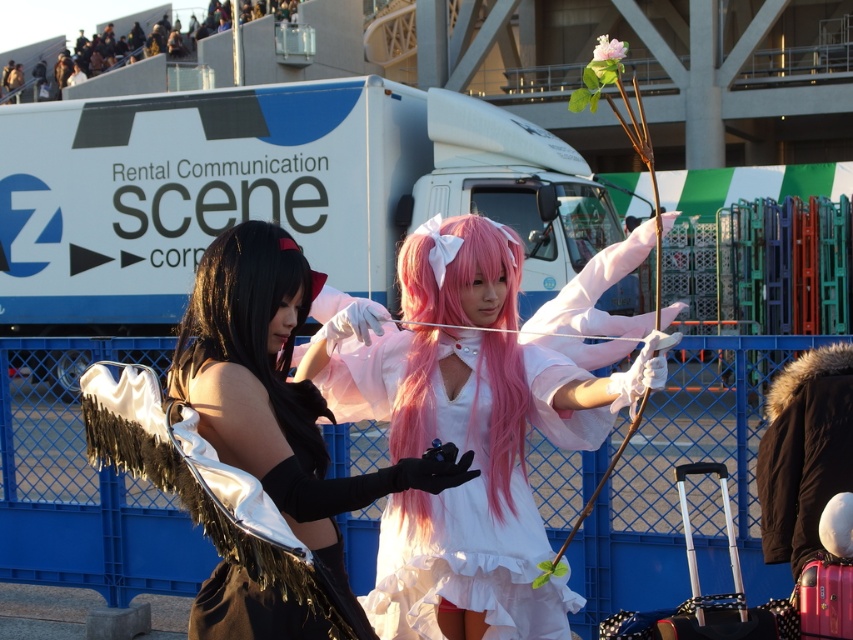
You are a photographer standing 5 meters away from the camera. You want to take a photo of the pink silky hair at center. Will you be able to capture it in your shot if your camera has a 3 meter range?

The pink silky hair at center and camera are 5.18 meters apart from each other. Since you are standing 5 meters away from the camera, the total distance between you and the pink silky hair at center would be 5 meters plus your own distance, but the camera itself is only 5.18 meters away from the hair. If your camera has a 3 meter range, you need to be within 3 meters of the subject. However, the camera is already 5.18 meters away, which exceeds the 3 meter range. Therefore, you won

You are a photographer at a cosplay event. You need to position the pink silky hair at center and the black fur coat at right in your shot. Which object should you focus on first if you want to capture the one that is higher in the frame?

Answer: The pink silky hair at center is above the black fur coat at right, so you should focus on the pink silky hair at center first to capture the higher object in the frame.

You are a photographer planning to take a photo of the two cosplayers. The white satin dress at center is represented by point (463, 435). Where should you position your camera to ensure the white satin dress at center is centered in the frame?

To center the white satin dress at center in the frame, position the camera directly facing the point (463, 435), ensuring the dress is at the center of the image.